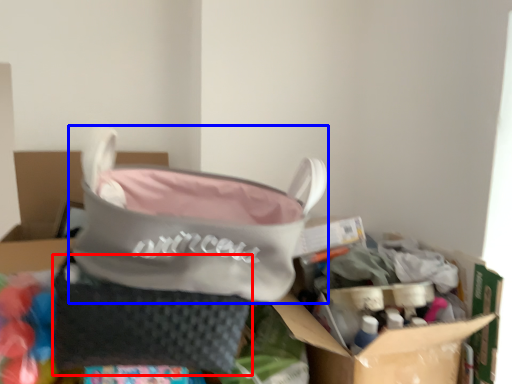
Question: Which point is closer to the camera, pouch (highlighted by a red box) or handbag (highlighted by a blue box)?

Choices:
 (A) pouch
 (B) handbag

Answer: (B)